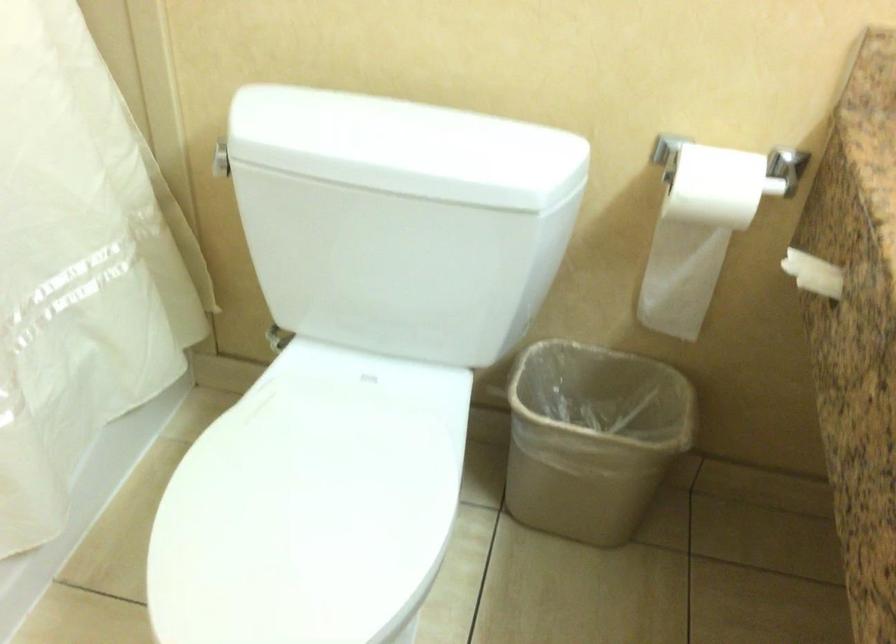
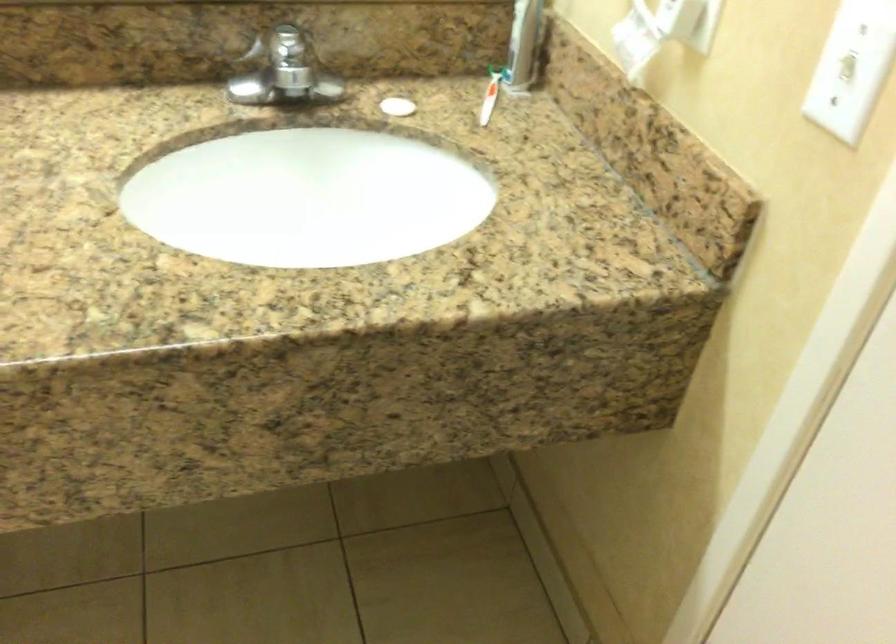
How did the camera likely rotate?

The camera's rotation is toward right-down.